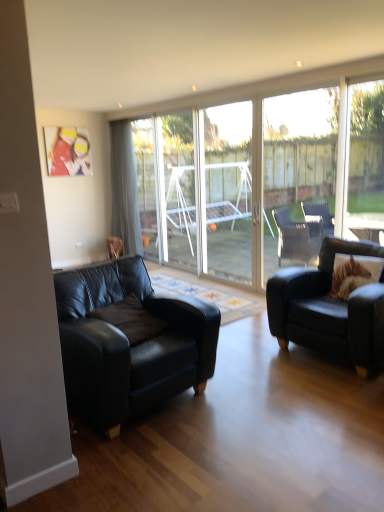
What are the coordinates of `free location to the right of black leather couch at left, which appears as the second studio couch when viewed from the right` in the screenshot? It's located at (263, 404).